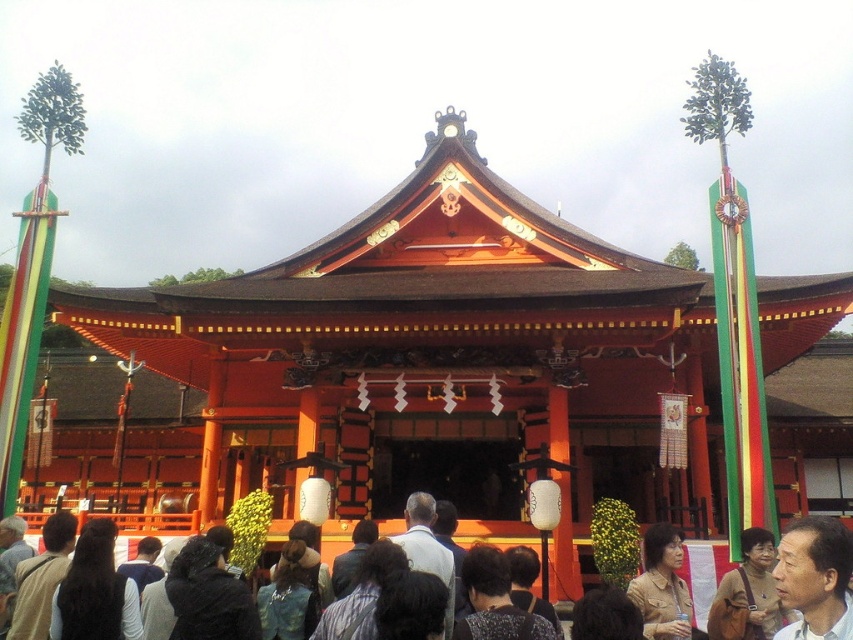
Question: Is smooth skin face at center smaller than tan leather jacket at lower right?

Choices:
 (A) yes
 (B) no

Answer: (A)

Question: Which object is farther from the camera taking this photo?

Choices:
 (A) tan leather jacket at lower right
 (B) smooth skin face at center

Answer: (A)

Question: Does smooth skin face at center appear under tan leather jacket at lower right?

Choices:
 (A) no
 (B) yes

Answer: (A)

Question: Can you confirm if smooth skin face at center is bigger than tan leather jacket at lower right?

Choices:
 (A) no
 (B) yes

Answer: (A)